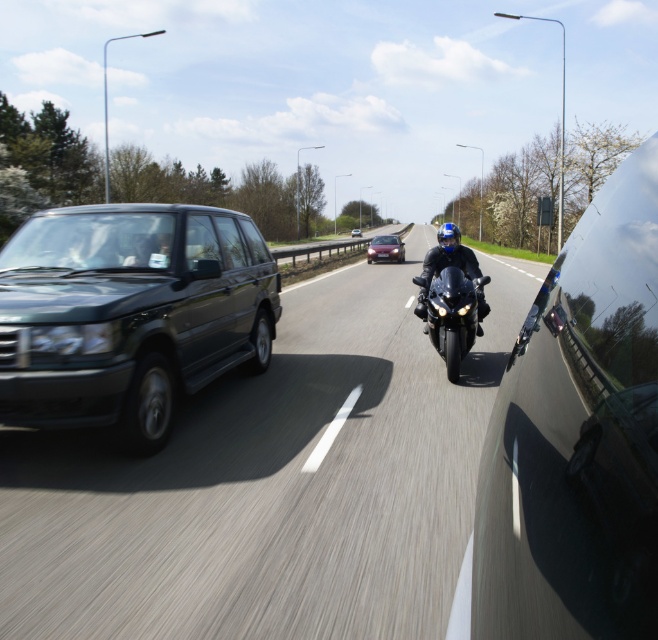
Between black glossy suv at left and matte black suv at left, which one is positioned higher?

matte black suv at left is higher up.

Identify the location of black glossy suv at left. The width and height of the screenshot is (658, 640). (272, 483).

The image size is (658, 640). Identify the location of black glossy suv at left. (272, 483).

Can you confirm if glossy black motorcycle at center is smaller than matte black suv at center?

Yes.

Which of these two, glossy black motorcycle at center or matte black suv at center, stands shorter?

Standing shorter between the two is glossy black motorcycle at center.

Is point (467, 257) positioned in front of point (355, 228)?

Yes, it is in front of point (355, 228).

Image resolution: width=658 pixels, height=640 pixels. Identify the location of glossy black motorcycle at center. (451, 298).

How distant is black glossy suv at left from glossy black motorcycle at center?

black glossy suv at left is 7.33 feet from glossy black motorcycle at center.

Is the position of black glossy suv at left more distant than that of glossy black motorcycle at center?

No, black glossy suv at left is closer to the viewer.

Does point (18, 564) lie behind point (478, 268)?

No, (18, 564) is closer to viewer.

Identify the location of black glossy suv at left. (272, 483).